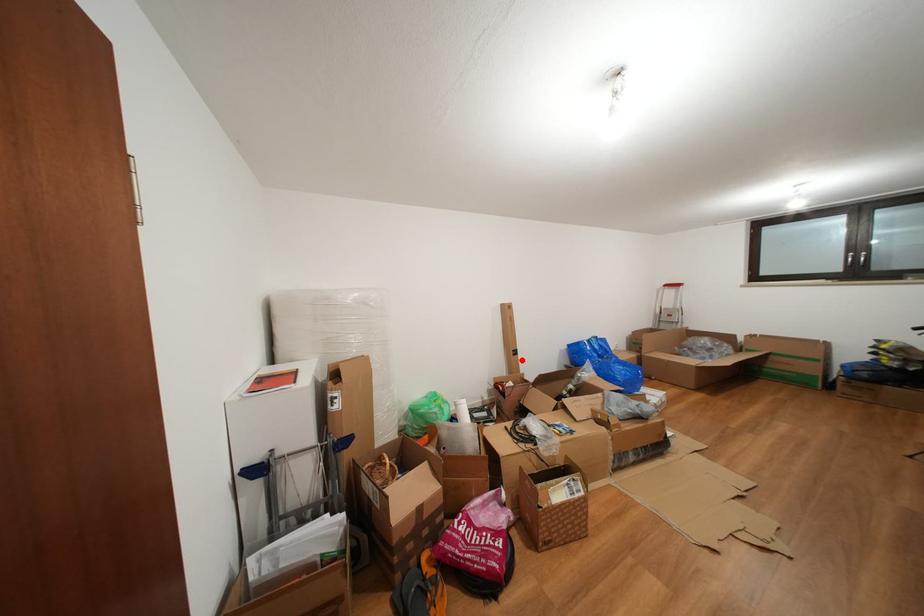
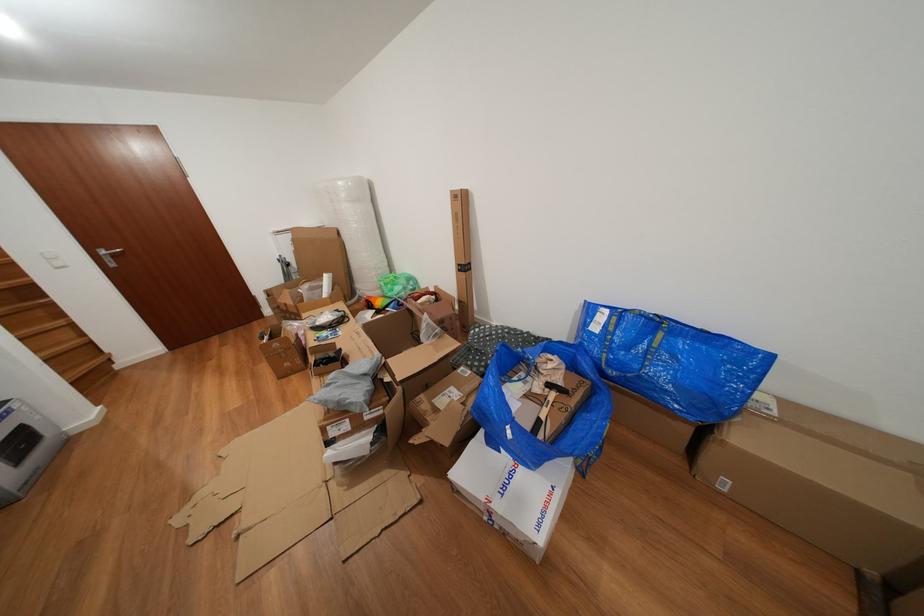
In the second image, find the point that corresponds to the highlighted location in the first image.

(468, 276)